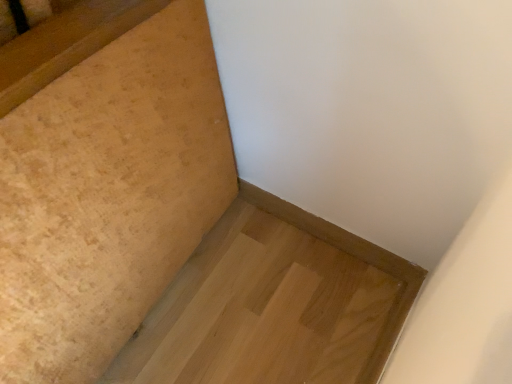
Describe the element at coordinates (108, 195) in the screenshot. I see `beige textured mattress at lower left` at that location.

Identify the location of beige textured mattress at lower left. (108, 195).

The image size is (512, 384). I want to click on beige textured mattress at lower left, so click(108, 195).